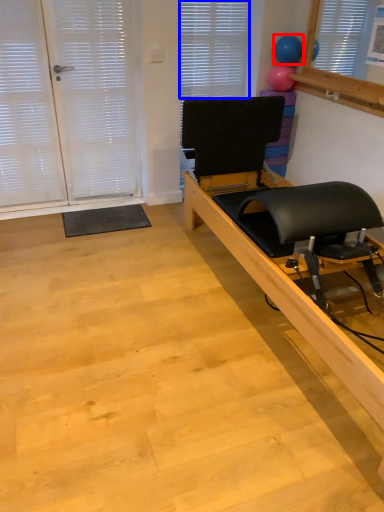
Question: Which object is closer to the camera taking this photo, balloon (highlighted by a red box) or blind (highlighted by a blue box)?

Choices:
 (A) balloon
 (B) blind

Answer: (A)